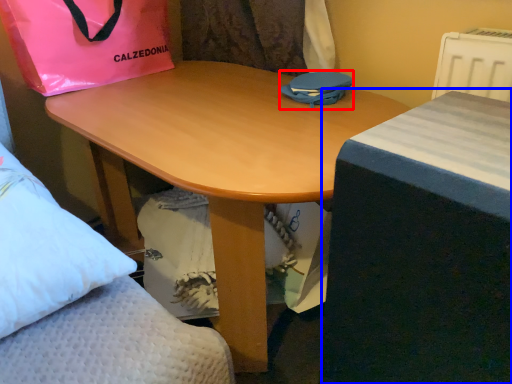
Question: Which of the following is the closest to the observer, bag (highlighted by a red box) or table (highlighted by a blue box)?

Choices:
 (A) bag
 (B) table

Answer: (B)